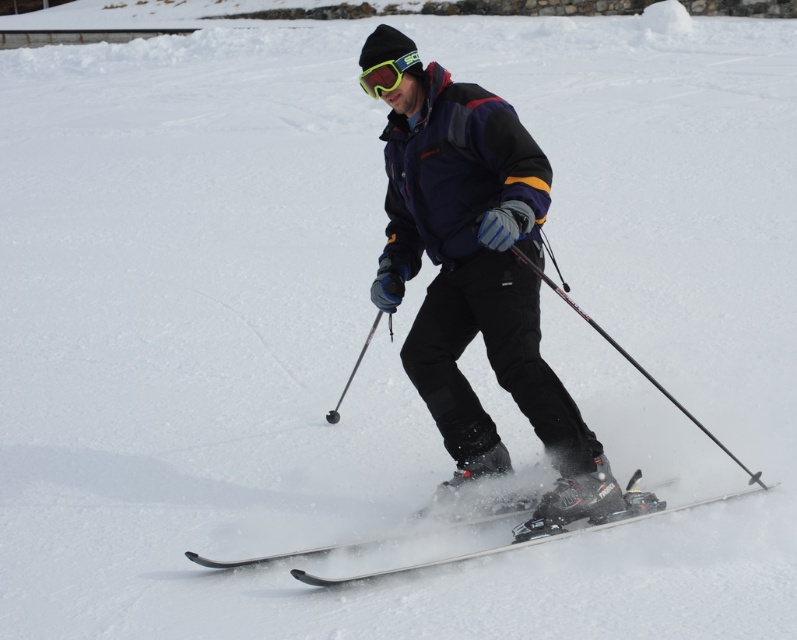
Question: Does matte blue ski jacket at center appear on the right side of black textured ski pole at center?

Choices:
 (A) no
 (B) yes

Answer: (A)

Question: Is white glossy skis at center below black textured ski pole at center?

Choices:
 (A) yes
 (B) no

Answer: (A)

Question: Which object is closer to the camera taking this photo?

Choices:
 (A) black textured ski pole at center
 (B) matte blue ski jacket at center
 (C) green reflective plastic goggles at center
 (D) white glossy skis at center

Answer: (B)

Question: Which of the following is the closest to the observer?

Choices:
 (A) green reflective plastic goggles at center
 (B) white glossy skis at center
 (C) black textured ski pole at center
 (D) matte blue ski jacket at center

Answer: (D)

Question: Based on their relative distances, which object is farther from the black textured ski pole at center?

Choices:
 (A) white glossy skis at center
 (B) matte blue ski jacket at center

Answer: (A)

Question: Can you confirm if matte blue ski jacket at center is thinner than white glossy skis at center?

Choices:
 (A) no
 (B) yes

Answer: (B)